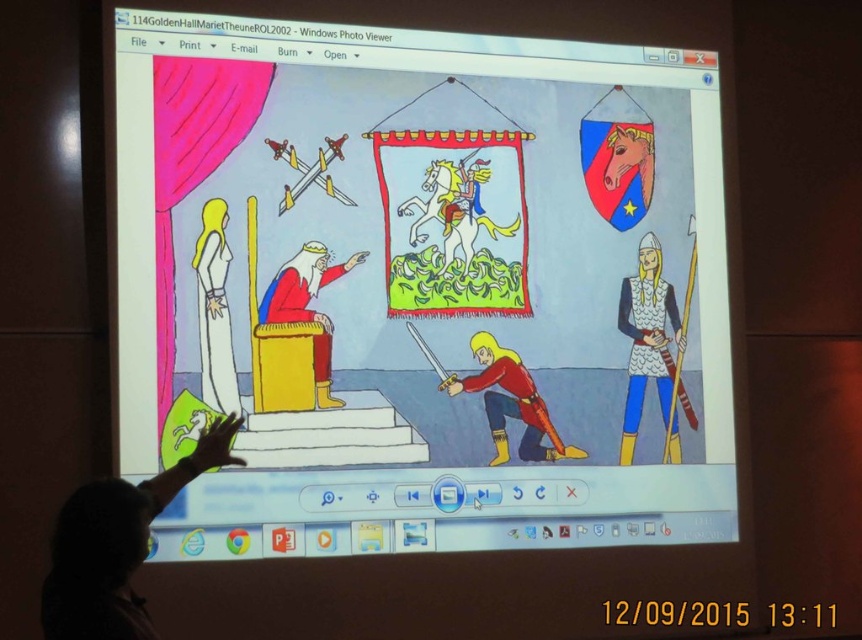
Between shiny red armor at lower center and white glossy dress at upper left, which one is positioned lower?

Positioned lower is shiny red armor at lower center.

Who is more forward, (501, 426) or (195, 248)?

Point (195, 248)

Describe the element at coordinates (510, 403) in the screenshot. I see `shiny red armor at lower center` at that location.

At what (x,y) coordinates should I click in order to perform the action: click on shiny red armor at lower center. Please return your answer as a coordinate pair (x, y). This screenshot has width=862, height=640. Looking at the image, I should click on (510, 403).

Between smooth skin hand at lower left and matte red fabric throne at center, which one has less height?

With less height is smooth skin hand at lower left.

How distant is smooth skin hand at lower left from matte red fabric throne at center?

smooth skin hand at lower left is 4.91 feet away from matte red fabric throne at center.

Does point (88, 637) come farther from viewer compared to point (326, 369)?

No, (88, 637) is closer to viewer.

I want to click on smooth skin hand at lower left, so click(x=116, y=545).

Is metallic chainmail armor at right wider than matte red fabric throne at center?

No, metallic chainmail armor at right is not wider than matte red fabric throne at center.

Can you confirm if metallic chainmail armor at right is taller than matte red fabric throne at center?

Yes, metallic chainmail armor at right is taller than matte red fabric throne at center.

What do you see at coordinates (650, 348) in the screenshot? The image size is (862, 640). I see `metallic chainmail armor at right` at bounding box center [650, 348].

Identify the location of metallic chainmail armor at right. (650, 348).